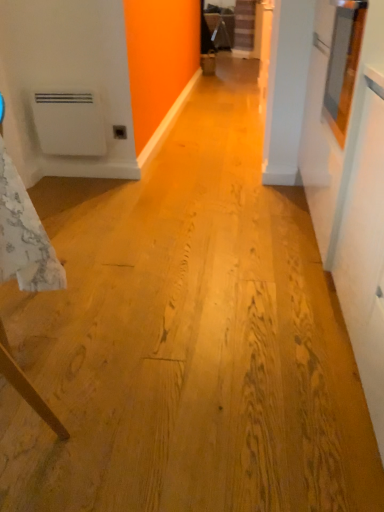
Describe the element at coordinates (24, 236) in the screenshot. I see `white textured tablecloth at left` at that location.

Where is `matte plastic outlet at center`? This screenshot has height=512, width=384. matte plastic outlet at center is located at coordinates (120, 132).

Can you confirm if white matte water heater at left is shorter than matte plastic outlet at center?

Incorrect, the height of white matte water heater at left does not fall short of that of matte plastic outlet at center.

From the image's perspective, is white matte water heater at left positioned above or below matte plastic outlet at center?

Clearly, from the image's perspective, white matte water heater at left is above matte plastic outlet at center.

Is white matte water heater at left to the left of matte plastic outlet at center from the viewer's perspective?

Indeed, white matte water heater at left is positioned on the left side of matte plastic outlet at center.

Can you confirm if white matte water heater at left is taller than white textured tablecloth at left?

No.

From the image's perspective, is white matte water heater at left over white textured tablecloth at left?

Correct, white matte water heater at left appears higher than white textured tablecloth at left in the image.

Based on their sizes in the image, would you say white matte water heater at left is bigger or smaller than white textured tablecloth at left?

In the image, white matte water heater at left appears to be smaller than white textured tablecloth at left.

From a real-world perspective, which object stands above the other?

From a 3D spatial view, white textured tablecloth at left is above.

Considering the sizes of matte plastic outlet at center and white textured tablecloth at left in the image, is matte plastic outlet at center taller or shorter than white textured tablecloth at left?

Clearly, matte plastic outlet at center is shorter compared to white textured tablecloth at left.

How many degrees apart are the facing directions of matte plastic outlet at center and white textured tablecloth at left?

They differ by 0.389 degrees in their facing directions.

In the scene shown: Which is more distant, (119, 139) or (2, 250)?

Positioned behind is point (119, 139).

Is matte plastic outlet at center beside white textured tablecloth at left?

No, matte plastic outlet at center is not beside white textured tablecloth at left.

Is white textured tablecloth at left turned away from matte plastic outlet at center?

That's right, white textured tablecloth at left is facing away from matte plastic outlet at center.

Is matte plastic outlet at center surrounded by white textured tablecloth at left?

No, matte plastic outlet at center is not a part of white textured tablecloth at left.

From a real-world perspective, who is located lower, white textured tablecloth at left or matte plastic outlet at center?

In real-world perspective, matte plastic outlet at center is lower.

Can you confirm if white textured tablecloth at left is thinner than matte plastic outlet at center?

No.

Considering the relative sizes of white textured tablecloth at left and white matte water heater at left in the image provided, is white textured tablecloth at left thinner than white matte water heater at left?

In fact, white textured tablecloth at left might be wider than white matte water heater at left.

Relative to white matte water heater at left, is white textured tablecloth at left in front or behind?

white textured tablecloth at left is positioned closer to the viewer than white matte water heater at left.

Consider the image. In the image, is white textured tablecloth at left on the left side or the right side of white matte water heater at left?

Clearly, white textured tablecloth at left is on the right of white matte water heater at left in the image.

At what (x,y) coordinates should I click in order to perform the action: click on water heater on the left of matte plastic outlet at center. Please return your answer as a coordinate pair (x, y). This screenshot has width=384, height=512. Looking at the image, I should click on (69, 123).

Considering the positions of objects matte plastic outlet at center and white matte water heater at left in the image provided, who is in front, matte plastic outlet at center or white matte water heater at left?

white matte water heater at left is closer to the camera.

Is point (120, 139) positioned behind point (44, 119)?

That is True.

Who is smaller, matte plastic outlet at center or white matte water heater at left?

With smaller size is matte plastic outlet at center.

At what (x,y) coordinates should I click in order to perform the action: click on electric outlet on the right of white matte water heater at left. Please return your answer as a coordinate pair (x, y). The height and width of the screenshot is (512, 384). Looking at the image, I should click on (120, 132).

Identify the location of water heater that is on the left side of white textured tablecloth at left. Image resolution: width=384 pixels, height=512 pixels. (69, 123).

Consider the image. Considering their positions, is white matte water heater at left positioned closer to white textured tablecloth at left than matte plastic outlet at center?

Based on the image, white matte water heater at left appears to be nearer to white textured tablecloth at left.

Based on the photo, which object lies further to the anchor point white matte water heater at left, white textured tablecloth at left or matte plastic outlet at center?

white textured tablecloth at left lies further to white matte water heater at left than the other object.

Considering their positions, is matte plastic outlet at center positioned closer to white matte water heater at left than white textured tablecloth at left?

Based on the image, matte plastic outlet at center appears to be nearer to white matte water heater at left.

Looking at the image, which one is located further to matte plastic outlet at center, white matte water heater at left or white textured tablecloth at left?

white textured tablecloth at left lies further to matte plastic outlet at center than the other object.

Estimate the real-world distances between objects in this image. Which object is closer to white textured tablecloth at left, matte plastic outlet at center or white matte water heater at left?

white matte water heater at left lies closer to white textured tablecloth at left than the other object.

Estimate the real-world distances between objects in this image. Which object is further from matte plastic outlet at center, white textured tablecloth at left or white matte water heater at left?

Among the two, white textured tablecloth at left is located further to matte plastic outlet at center.

Find the location of a particular element. water heater between white textured tablecloth at left and matte plastic outlet at center from front to back is located at coordinates (69, 123).